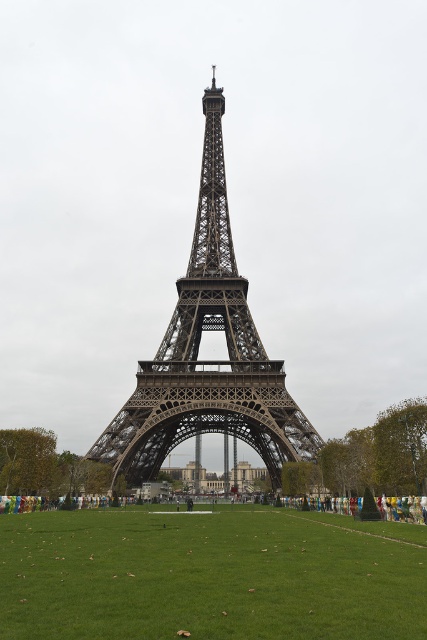
Consider the image. You are standing at the camera position and want to reach the point at coordinates point (x=263, y=598). If your walking speed is 1.5 m per second, how many seconds will it take to reach there?

The distance of point (x=263, y=598) from camera is 79.90 meters. At a speed of 1.5 m per second, it will take approximately 53.27 seconds to reach the point.

You are a photographer planning to take a wide shot of the dark gray metal eiffel tower at center and the green grass at center. Which object will appear smaller in the photo?

The green grass at center will appear smaller in the photo because it has a smaller size compared to the dark gray metal eiffel tower at center.